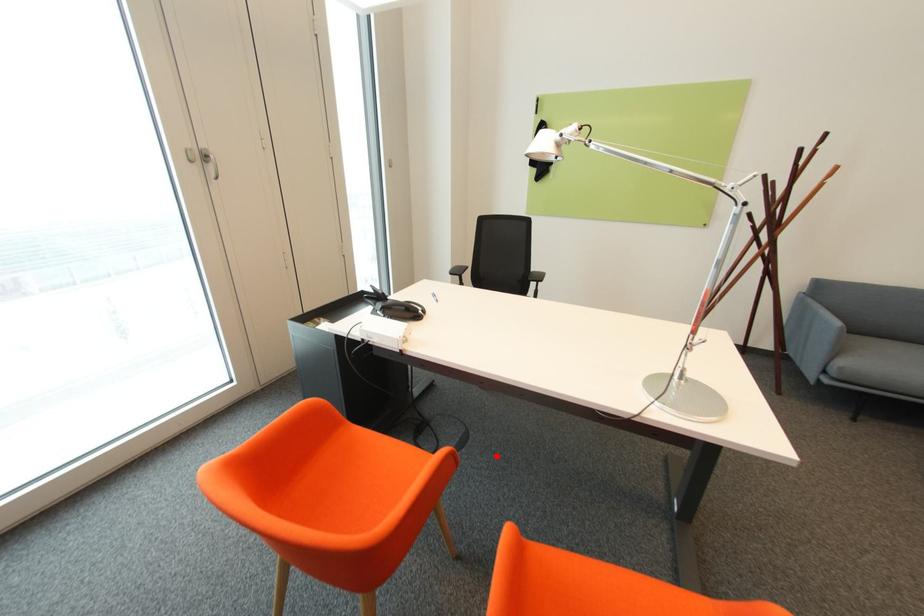
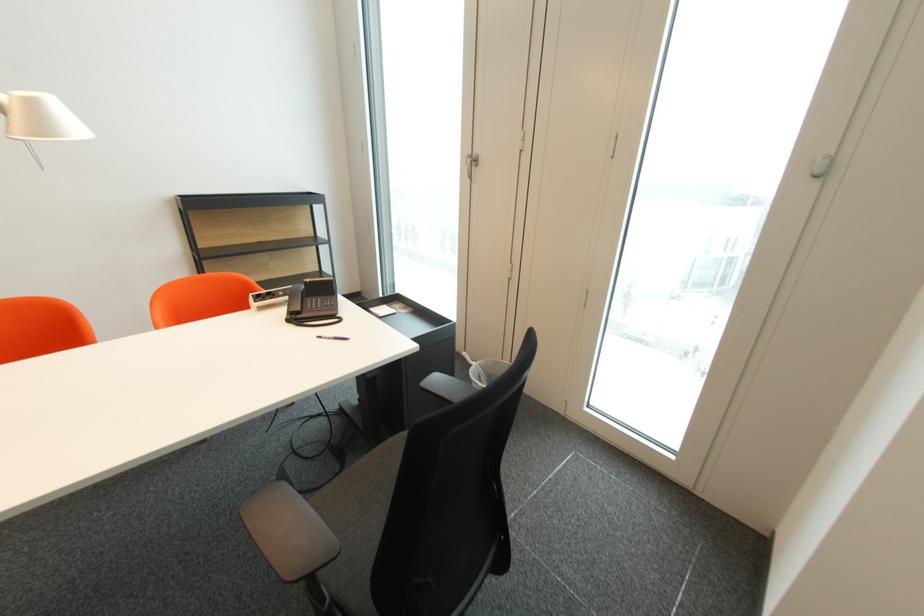
Question: I am providing you with two images of the same scene from different viewpoints. Image1 has a red point marked. In image2, the corresponding 3D location appears at what relative position? Reply with the corresponding letter.

Choices:
 (A) Closer
 (B) Farther

Answer: (A)